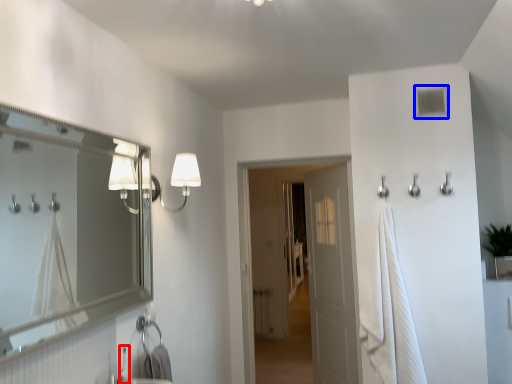
Question: Among these objects, which one is nearest to the camera, faucet (highlighted by a red box) or window (highlighted by a blue box)?

Choices:
 (A) faucet
 (B) window

Answer: (A)